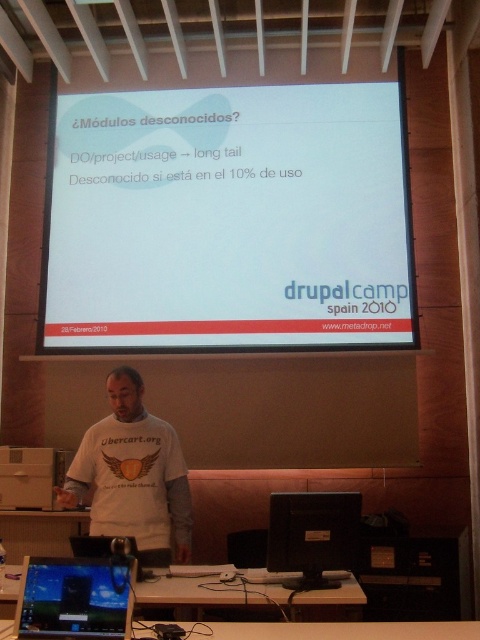
What is the exact coordinate of the black glossy laptop at lower left in the presentation setting?

The black glossy laptop at lower left is located at point (74,598).

You are an event organizer setting up for a presentation. You need to ensure that the black glossy laptop at lower left can connect to the white matte projection screen at upper center. Based on their positions, is the laptop positioned in a way that allows it to easily connect to the screen?

The black glossy laptop at lower left is behind the white matte projection screen at upper center, so it might be positioned in a way that makes connecting cables difficult or obstructed. Ensure there is enough space or reposition the laptop for easier access.